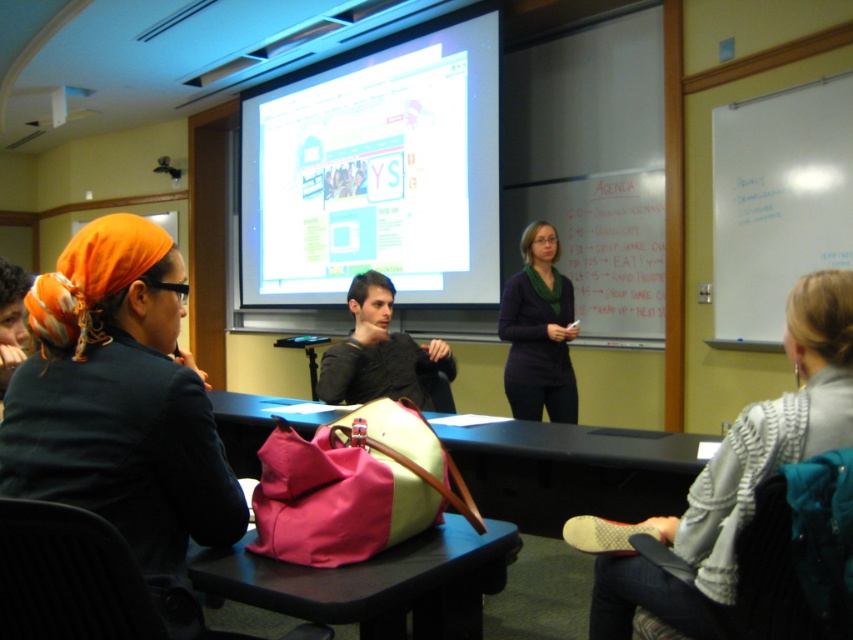
You are organizing a classroom activity and need to place a small plant between the pink fabric bag at center and the dark purple sweater at center. Considering their heights, which object should the plant be placed closer to?

The plant should be placed closer to the pink fabric bag at center because it has a lesser height compared to the dark purple sweater at center, ensuring the plant remains visible to all participants.

You are organizing a classroom event and need to place a name tag on the table. The name tag is the same size as the pink fabric bag at center. Will the name tag fit next to the dark purple sweater at center without overlapping?

The pink fabric bag at center has a smaller size compared to the dark purple sweater at center. Since the name tag is the same size as the pink fabric bag at center, it will fit next to the dark purple sweater at center without overlapping because the sweater is larger and there should be enough space.

You are organizing a classroom cleanup and need to retrieve the pink fabric bag at center. However, the striped sweater at lower right is covering it. Can you easily access the bag without moving the sweater?

The striped sweater at lower right is positioned over the pink fabric bag at center, so you would need to move the sweater to access the bag.